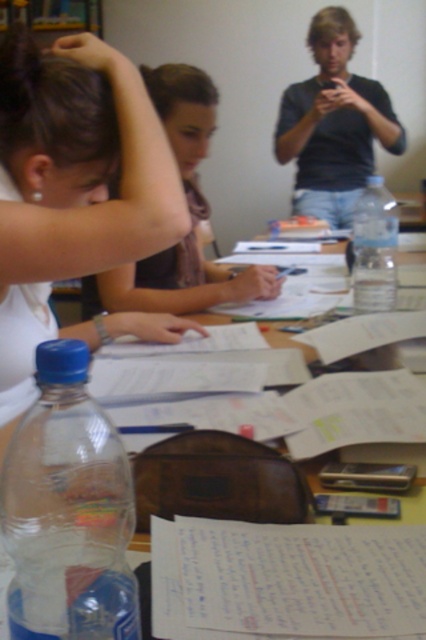
Which is above, matte black shirt at upper center or brown hair at upper left?

matte black shirt at upper center is above.

Which of these two, matte black shirt at upper center or brown hair at upper left, stands shorter?

brown hair at upper left

Who is more distant from viewer, (336, 172) or (184, 112)?

The point (336, 172) is behind.

You are a GUI agent. You are given a task and a screenshot of the screen. Output one action in this format:
    pyautogui.click(x=<x>, y=<y>)
    Task: Click on the matte black shirt at upper center
    This screenshot has width=426, height=640.
    Given the screenshot: What is the action you would take?
    pyautogui.click(x=333, y=124)

Who is positioned more to the right, matte black hair at upper left or matte brown hair at center?

matte brown hair at center is more to the right.

Does matte black hair at upper left have a lesser height compared to matte brown hair at center?

Indeed, matte black hair at upper left has a lesser height compared to matte brown hair at center.

Between point (34, 67) and point (209, 129), which one is positioned behind?

The point (209, 129) is behind.

Where is `matte black hair at upper left`? This screenshot has height=640, width=426. matte black hair at upper left is located at coordinates (54, 125).

Looking at this image, is white paper at center closer to camera compared to matte brown hair at center?

Yes.

Based on the photo, does white paper at center have a lesser height compared to matte brown hair at center?

Correct, white paper at center is not as tall as matte brown hair at center.

Where is `white paper at center`? The image size is (426, 640). white paper at center is located at coordinates (x=285, y=579).